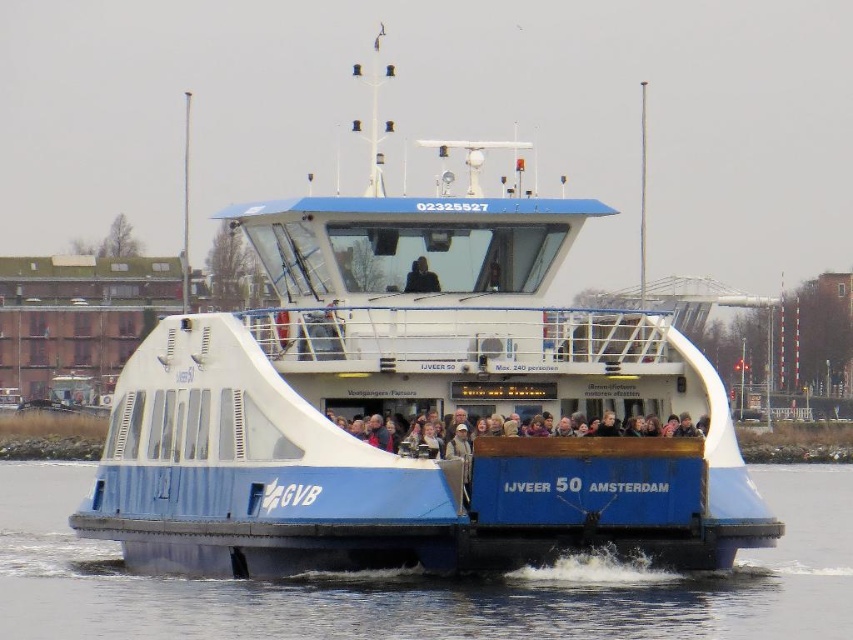
Is blue matte ferry at center taller than dark blue fabric jacket at center?

Correct, blue matte ferry at center is much taller as dark blue fabric jacket at center.

In the scene shown: Between blue matte ferry at center and dark blue fabric jacket at center, which one appears on the right side from the viewer's perspective?

From the viewer's perspective, dark blue fabric jacket at center appears more on the right side.

Between point (759, 513) and point (409, 288), which one is positioned behind?

Point (409, 288)

I want to click on blue matte ferry at center, so click(408, 406).

Who is more forward, (733,618) or (421,257)?

Positioned in front is point (733,618).

Which of these two, blue smooth water at center or dark blue fabric jacket at center, stands shorter?

dark blue fabric jacket at center

Based on the photo, who is more distant from viewer, (619, 627) or (434, 285)?

Positioned behind is point (434, 285).

Identify the location of blue smooth water at center. This screenshot has height=640, width=853. (428, 582).

Does light brown wooden bench at center appear on the left side of dark blue fabric jacket at center?

No, light brown wooden bench at center is not to the left of dark blue fabric jacket at center.

Find the location of `light brown wooden bench at center`. light brown wooden bench at center is located at coordinates coord(589,445).